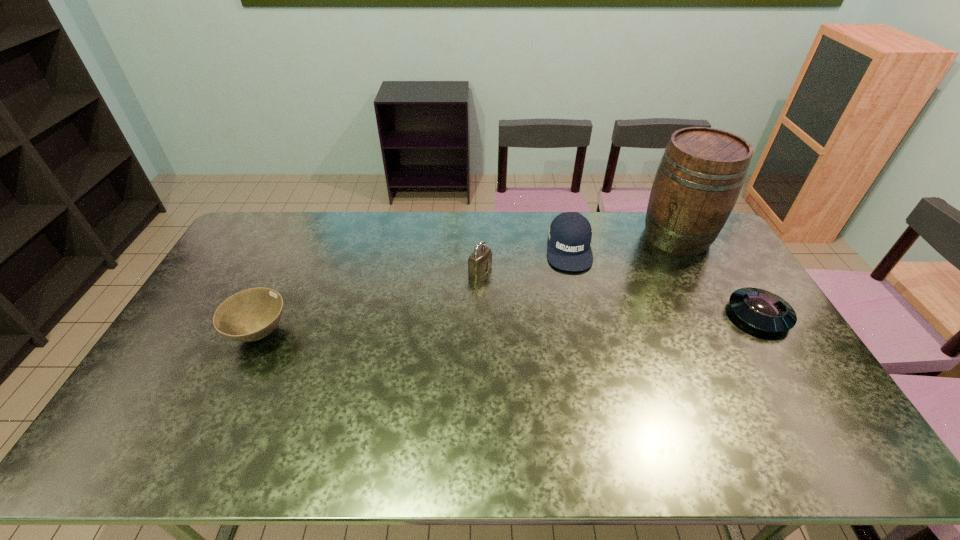
The image size is (960, 540). Identify the location of cider that is at the right edge. (700, 176).

Image resolution: width=960 pixels, height=540 pixels. In order to click on object at the far right corner in this screenshot , I will do `click(700, 176)`.

In the image, there is a desktop. Where is `vacant space at the far edge`? vacant space at the far edge is located at coordinates (623, 214).

Find the location of a particular element. The height and width of the screenshot is (540, 960). free spot at the near edge of the desktop is located at coordinates (212, 415).

I want to click on vacant area at the left edge, so click(x=170, y=384).

In the image, there is a desktop. At what (x,y) coordinates should I click in order to perform the action: click on vacant space at the far left corner. Please return your answer as a coordinate pair (x, y). Image resolution: width=960 pixels, height=540 pixels. Looking at the image, I should click on (265, 241).

This screenshot has width=960, height=540. I want to click on free area in between the leftmost object and the padlock, so click(370, 302).

Where is `vacant area that lies between the bowl and the padlock`? The image size is (960, 540). vacant area that lies between the bowl and the padlock is located at coordinates (370, 302).

What are the coordinates of `free space between the baseball cap and the leftmost object` in the screenshot? It's located at (415, 291).

In order to click on unoccupied area between the second object from left to right and the baseball cap in this screenshot , I will do `click(524, 259)`.